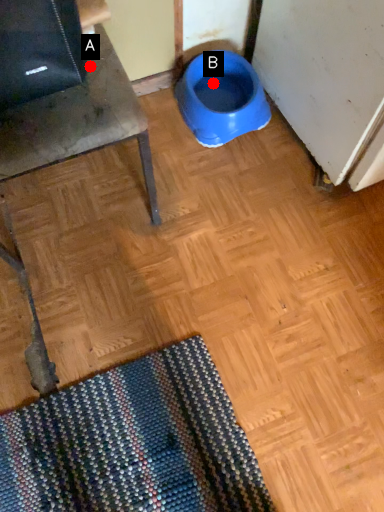
Question: Two points are circled on the image, labeled by A and B beside each circle. Which point is closer to the camera taking this photo?

Choices:
 (A) A is closer
 (B) B is closer

Answer: (A)